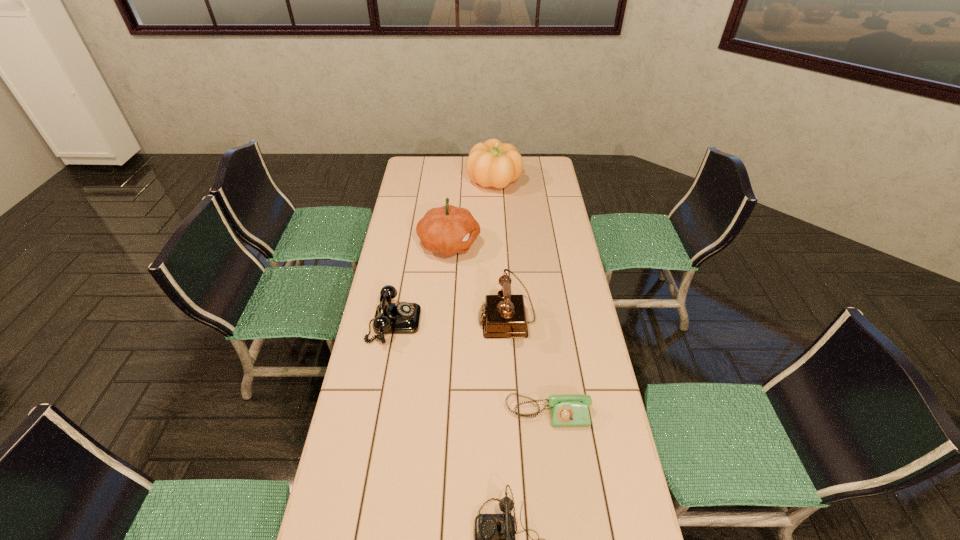
Where is `vacant area located 0.170m on the dial of the fourth shortest object`? vacant area located 0.170m on the dial of the fourth shortest object is located at coordinates (432, 318).

Where is `free location located on the dial of the third shortest object`? This screenshot has width=960, height=540. free location located on the dial of the third shortest object is located at coordinates (524, 322).

Where is `vacant region located on the dial of the second nearest object`? The height and width of the screenshot is (540, 960). vacant region located on the dial of the second nearest object is located at coordinates (552, 444).

The image size is (960, 540). I want to click on object that is at the far edge, so click(492, 163).

Where is `pumpkin located at the left edge`? The image size is (960, 540). pumpkin located at the left edge is located at coordinates (447, 230).

Where is `telephone at the left edge`? The image size is (960, 540). telephone at the left edge is located at coordinates (390, 318).

Locate an element on the screen. object that is positioned at the right edge is located at coordinates (x=566, y=410).

Locate an element on the screen. This screenshot has height=540, width=960. vacant space at the left edge of the desktop is located at coordinates (390, 352).

The width and height of the screenshot is (960, 540). In the image, there is a desktop. In order to click on vacant space at the right edge in this screenshot , I will do `click(589, 328)`.

You are a GUI agent. You are given a task and a screenshot of the screen. Output one action in this format:
    pyautogui.click(x=<x>, y=<y>)
    Task: Click on the free location at the far left corner
    The image size is (960, 540).
    Given the screenshot: What is the action you would take?
    pyautogui.click(x=416, y=165)